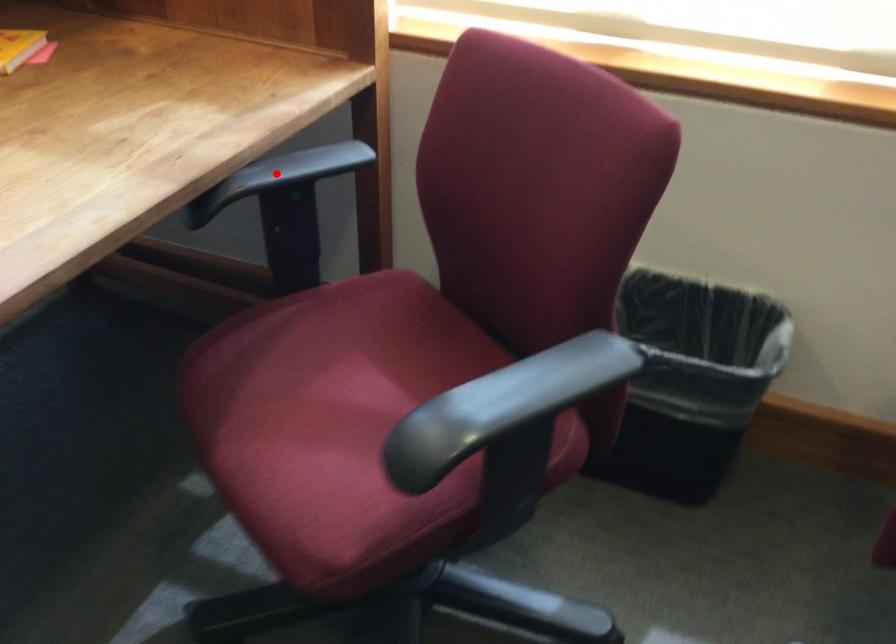
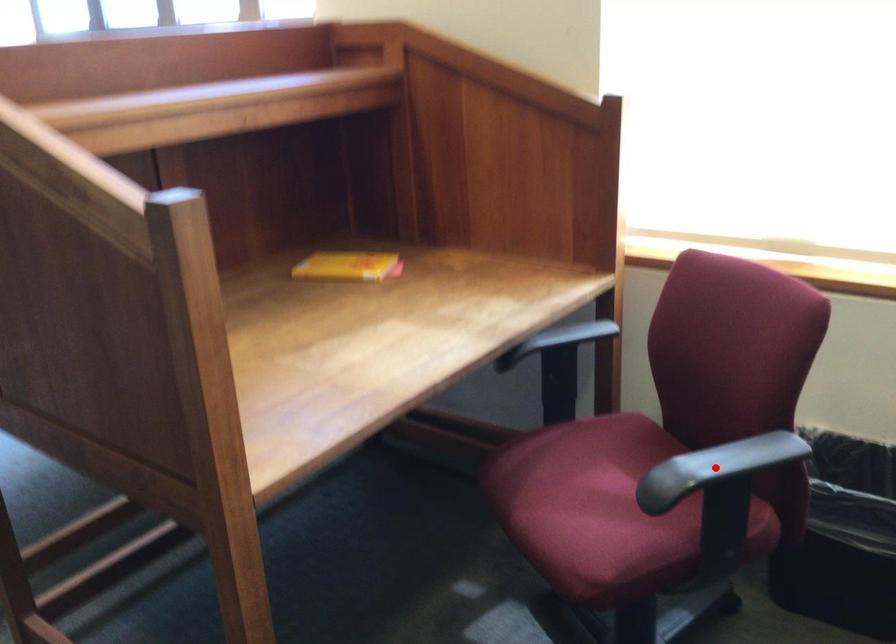
I am providing you with two images of the same scene from different viewpoints. A red point is marked on the first image and another point is marked on the second image. Is the red point in image1 aligned with the point shown in image2?

No